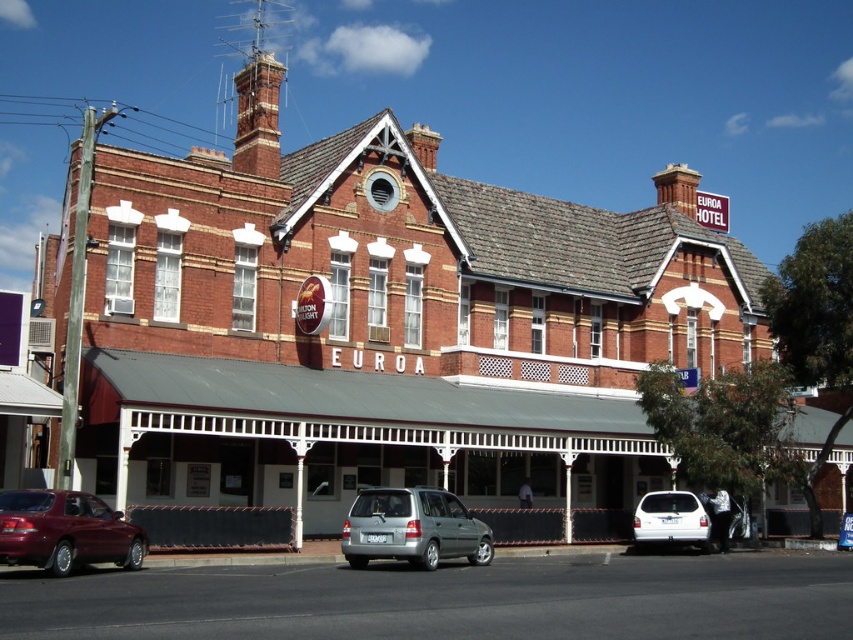
Which is behind, point (123, 560) or point (653, 502)?

Point (653, 502)

Between shiny maroon sedan at lower left and white matte van at lower right, which one has less height?

With less height is white matte van at lower right.

The image size is (853, 640). Find the location of `shiny maroon sedan at lower left`. shiny maroon sedan at lower left is located at coordinates (65, 531).

What do you see at coordinates (412, 529) in the screenshot?
I see `silver metallic minivan at center` at bounding box center [412, 529].

You are a GUI agent. You are given a task and a screenshot of the screen. Output one action in this format:
    pyautogui.click(x=<x>, y=<y>)
    Task: Click on the silver metallic minivan at center
    The width and height of the screenshot is (853, 640).
    Given the screenshot: What is the action you would take?
    pyautogui.click(x=412, y=529)

Find the location of a particular element. silver metallic minivan at center is located at coordinates (412, 529).

Which is above, shiny maroon sedan at lower left or silver metallic minivan at center?

silver metallic minivan at center

Is point (96, 536) positioned after point (421, 540)?

That is False.

Find the location of a particular element. The width and height of the screenshot is (853, 640). shiny maroon sedan at lower left is located at coordinates (65, 531).